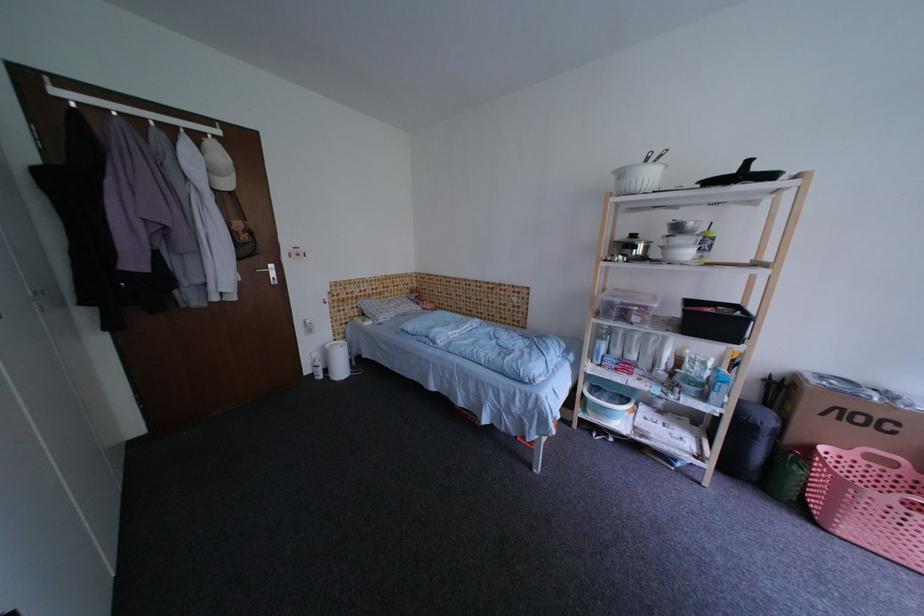
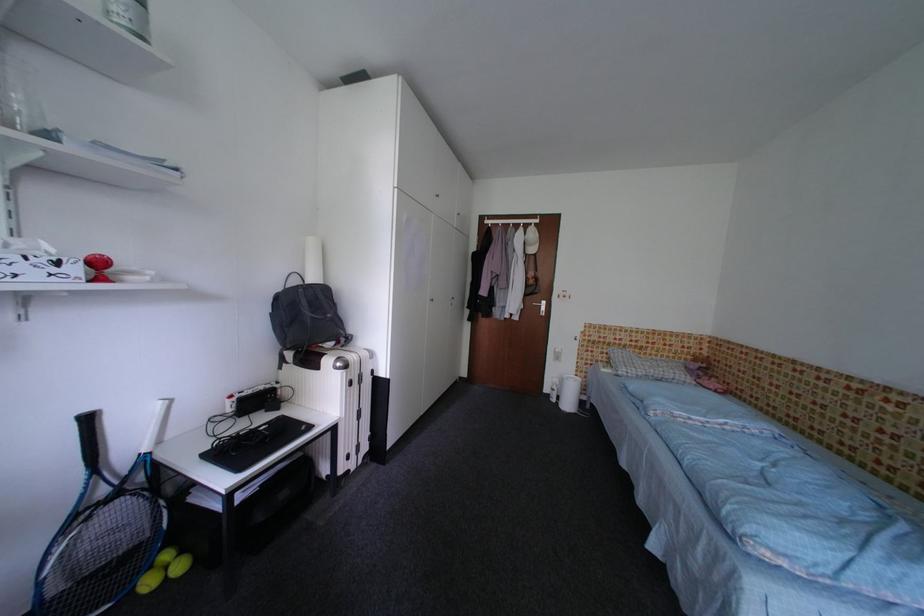
In the second image, find the point that corresponds to [250,265] in the first image.

(536, 300)